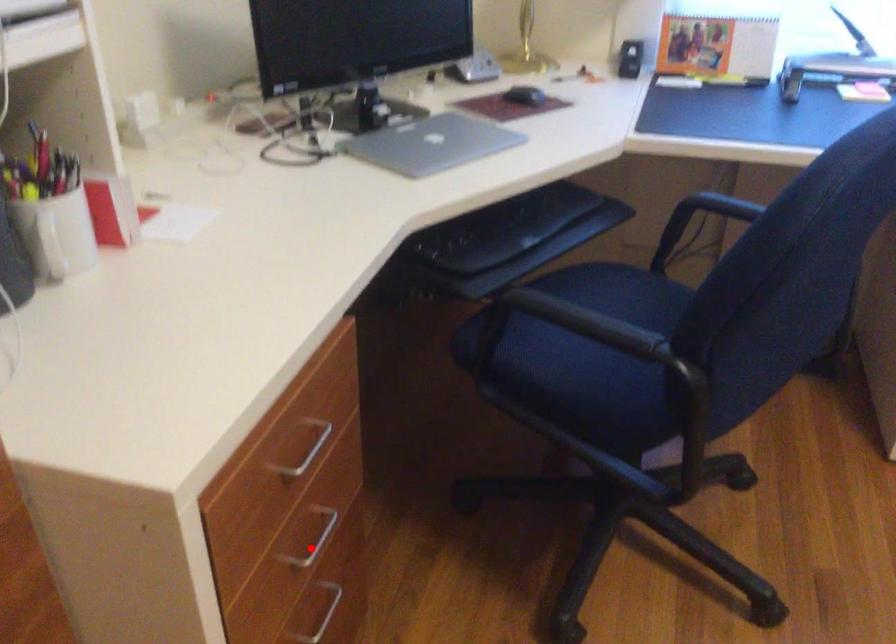
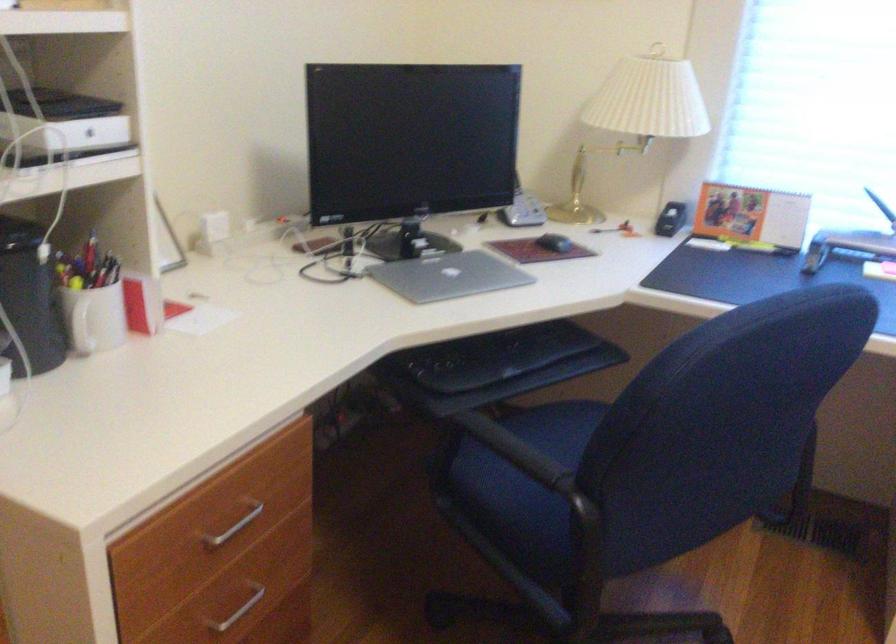
Where in the second image is the point corresponding to the highlighted location from the first image?

(238, 611)